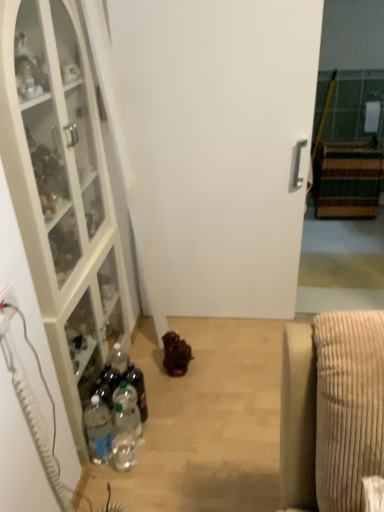
Question: Is point (139, 402) positioned closer to the camera than point (94, 419)?

Choices:
 (A) farther
 (B) closer

Answer: (A)

Question: Considering their positions, is clear plastic bottle at center, the 3th bottle in the left-to-right sequence, located in front of or behind clear plastic bottle at lower left, which is the 1th bottle in left-to-right order?

Choices:
 (A) behind
 (B) front

Answer: (A)

Question: Which of these objects is positioned farthest from the clear plastic bottle at lower left, which is the 1th bottle in left-to-right order?

Choices:
 (A) striped carpet at right, which ranks as the 2th cabinetry in left-to-right order
 (B) clear plastic bottle at center, the 1th bottle when ordered from right to left
 (C) white matte door at center
 (D) white glass cabinet at left, which ranks as the first cabinetry in left-to-right order
 (E) clear plastic bottle at lower left, the 2th bottle positioned from the left

Answer: (A)

Question: Based on their relative distances, which object is nearer to the clear plastic bottle at lower left, marked as the second bottle in a right-to-left arrangement?

Choices:
 (A) white plastic electric outlet at lower left
 (B) white matte door at center
 (C) clear plastic bottle at center, the 3th bottle in the left-to-right sequence
 (D) white glass cabinet at left, the 2th cabinetry when ordered from back to front
 (E) clear plastic bottle at lower left, which is the 3th bottle from right to left

Answer: (E)